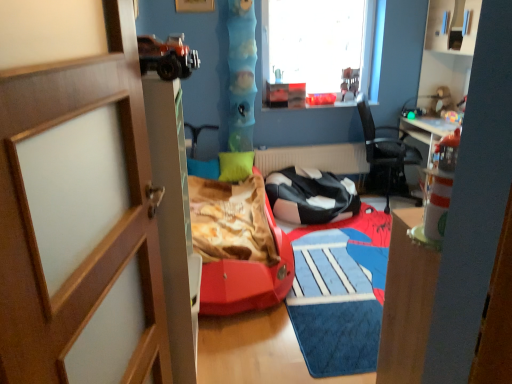
Image resolution: width=512 pixels, height=384 pixels. Identify the location of free space above white matte radiator at center (from a real-world perspective). (314, 147).